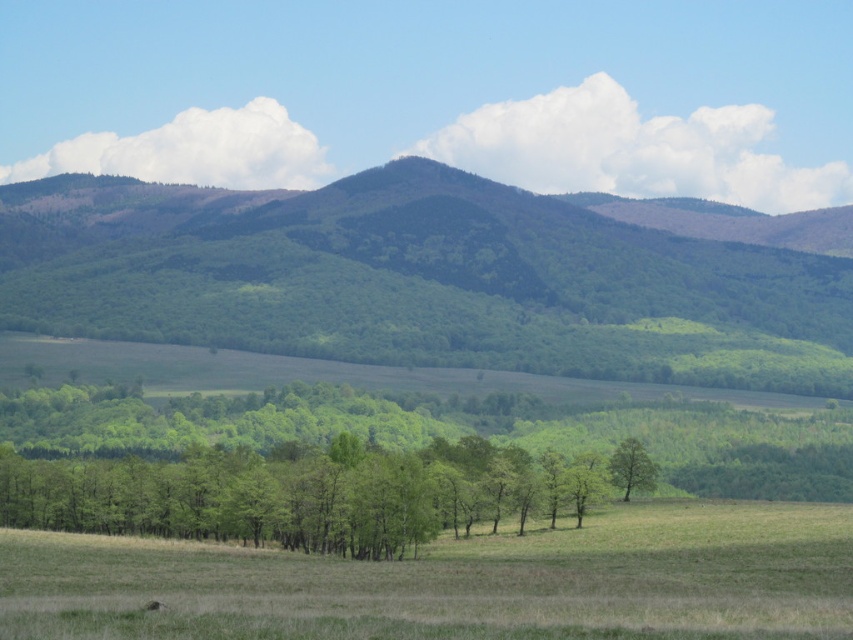
You are standing in the grassy field and want to walk to the green forested hill at center. However, there is a green matte tree at center in your path. Which object will you encounter first?

You will encounter the green matte tree at center first because it is closer to you than the green forested hill at center.

You are standing in the middle of the grassy field in the foreground of the landscape. You see two points marked in the scene. Which point is closer to you, point at coordinate (728, 282) or point at coordinate (647, 464)?

Point at coordinate (647, 464) is closer to you because it is less further to the camera than point at coordinate (728, 282).